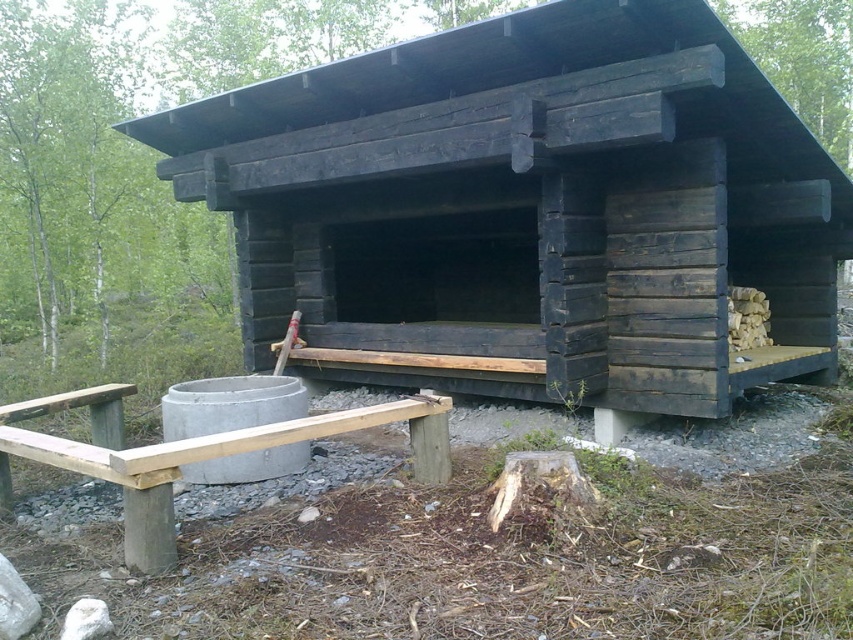
Image resolution: width=853 pixels, height=640 pixels. What do you see at coordinates (527, 211) in the screenshot?
I see `black wood hut at center` at bounding box center [527, 211].

Between point (579, 124) and point (21, 413), which one is positioned in front?

Point (579, 124)

Is point (548, 77) closer to viewer compared to point (131, 496)?

No, (548, 77) is behind (131, 496).

Identify the location of black wood hut at center. (527, 211).